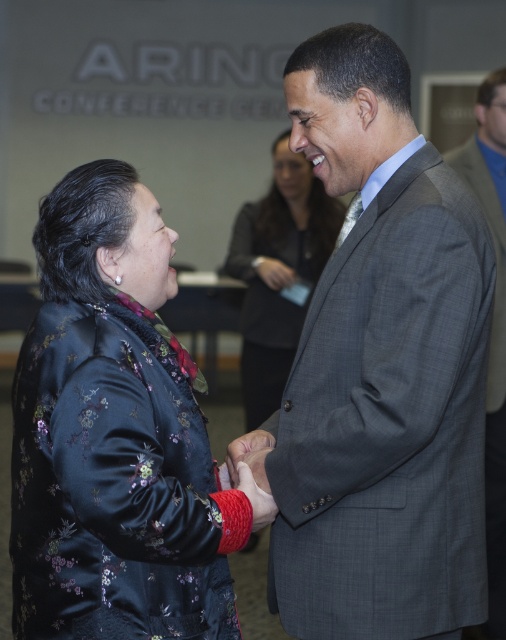
Question: Which point is farther to the camera?

Choices:
 (A) gray textured suit at center
 (B) silky black blouse at center

Answer: (B)

Question: Observing the image, what is the correct spatial positioning of gray textured suit at center in reference to satin floral jacket at left?

Choices:
 (A) right
 (B) left

Answer: (A)

Question: Is gray textured suit at center bigger than satin floral jacket at left?

Choices:
 (A) no
 (B) yes

Answer: (B)

Question: Is gray textured suit at center positioned at the back of satin floral jacket at left?

Choices:
 (A) yes
 (B) no

Answer: (A)

Question: Which of these objects is positioned farthest from the satin floral jacket at left?

Choices:
 (A) gray textured suit at center
 (B) silky black blouse at center

Answer: (B)

Question: Which object is farther from the camera taking this photo?

Choices:
 (A) gray plaid suit at center
 (B) silky black blouse at center
 (C) gray textured suit at center
 (D) satin floral jacket at left

Answer: (B)